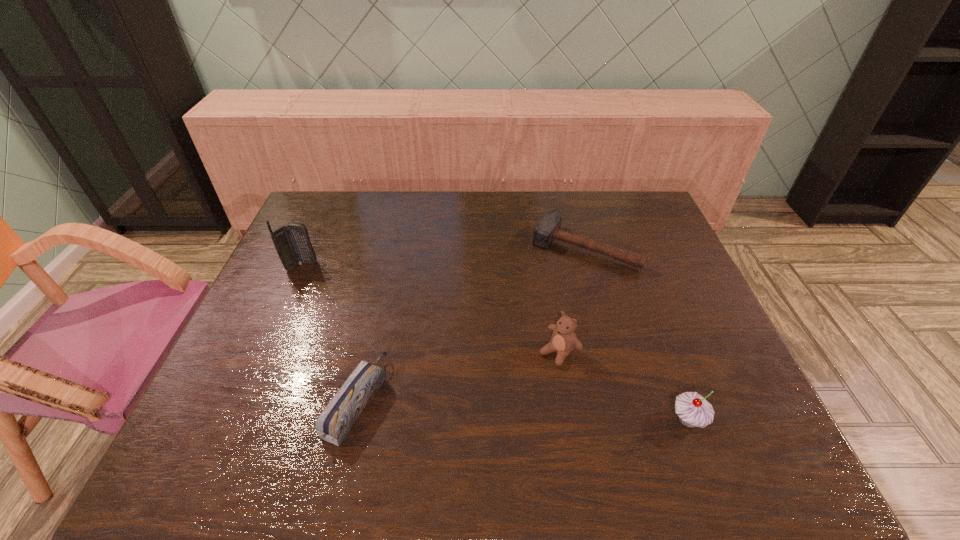
I want to click on free space located on the striking surface of the shortest object, so 543,302.

Locate an element on the screen. Image resolution: width=960 pixels, height=540 pixels. vacant space situated on the front-facing side of the teddy bear is located at coordinates (492, 414).

Image resolution: width=960 pixels, height=540 pixels. I want to click on free location located on the front-facing side of the teddy bear, so click(507, 400).

I want to click on vacant region located on the front-facing side of the teddy bear, so click(492, 414).

You are a GUI agent. You are given a task and a screenshot of the screen. Output one action in this format:
    pyautogui.click(x=<x>, y=<y>)
    Task: Click on the free space located on the keyboard of the tallest object
    
    Given the screenshot: What is the action you would take?
    325,278

Find the location of a particular element. vacant space located on the keyboard of the tallest object is located at coordinates (335, 283).

Where is `vacant region located on the keyboard of the tallest object`? The height and width of the screenshot is (540, 960). vacant region located on the keyboard of the tallest object is located at coordinates (392, 316).

Where is `object present at the far edge`? object present at the far edge is located at coordinates (548, 229).

Find the location of a particular element. pencil box located at the near edge is located at coordinates (335, 422).

At what (x,y) coordinates should I click in order to perform the action: click on cupcake at the near edge. Please return your answer as a coordinate pair (x, y). This screenshot has width=960, height=540. Looking at the image, I should click on (693, 410).